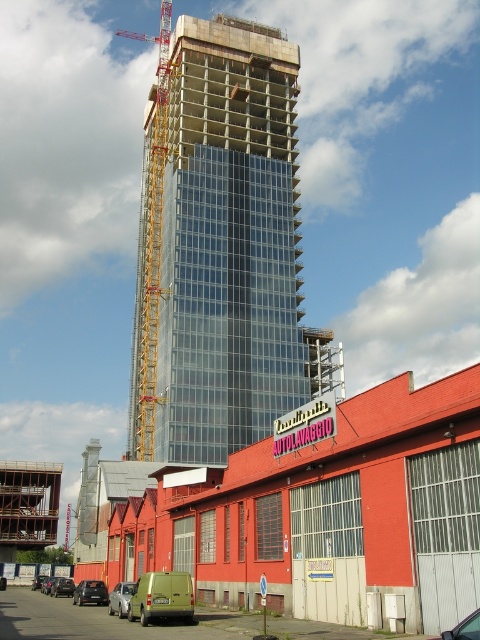
Question: Which of the following is the farthest from the observer?

Choices:
 (A) transparent glass tower at center
 (B) black matte car at lower left
 (C) dark gray matte van at lower left
 (D) silver metallic van at lower left

Answer: (C)

Question: Can you confirm if black matte car at lower left is positioned to the left of dark gray matte van at lower left?

Choices:
 (A) yes
 (B) no

Answer: (B)

Question: Does yellow metal crane at left have a smaller size compared to metallic green van at lower left?

Choices:
 (A) yes
 (B) no

Answer: (B)

Question: Estimate the real-world distances between objects in this image. Which object is closer to the metallic green van at lower left?

Choices:
 (A) yellow metal crane at left
 (B) black matte car at lower left
 (C) shiny silver car at lower left
 (D) transparent glass tower at center

Answer: (C)

Question: Does metallic green van at lower left appear on the right side of black matte car at lower left?

Choices:
 (A) no
 (B) yes

Answer: (B)

Question: Which object appears farthest from the camera in this image?

Choices:
 (A) silver metallic van at lower left
 (B) metallic green van at lower left
 (C) dark gray matte van at lower left
 (D) black matte car at lower left

Answer: (C)